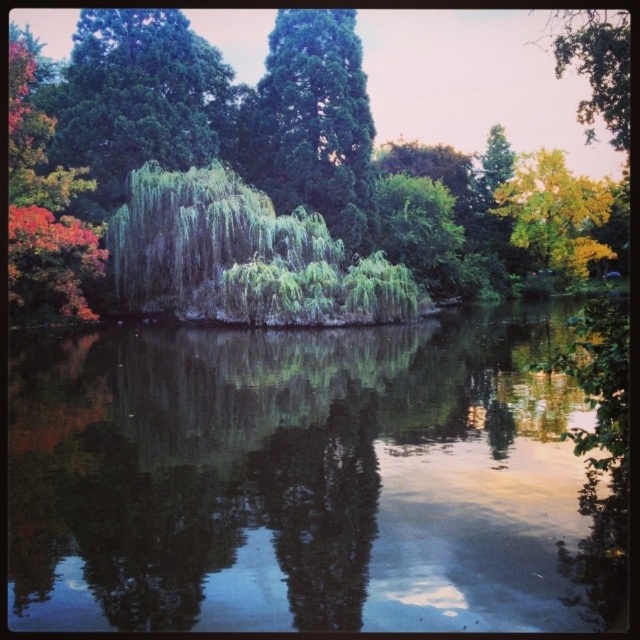
Is point (116, 20) positioned after point (570, 186)?

No, it is in front of (570, 186).

Which of these two, green leafy tree at upper left or yellow-green leafy willow at upper right, stands shorter?

green leafy tree at upper left is shorter.

Where is `green leafy tree at upper left`? This screenshot has width=640, height=640. green leafy tree at upper left is located at coordinates (138, 99).

Can you confirm if green leafy tree at center is smaller than green leafy willow at center?

Incorrect, green leafy tree at center is not smaller in size than green leafy willow at center.

Between green leafy tree at center and green leafy willow at center, which one is positioned lower?

green leafy willow at center is below.

Describe the element at coordinates (422, 88) in the screenshot. I see `green leafy tree at center` at that location.

The width and height of the screenshot is (640, 640). I want to click on green leafy tree at center, so click(422, 88).

Who is more distant from viewer, (17, 580) or (451, 68)?

The point (451, 68) is more distant.

Which is in front, point (509, 456) or point (26, 17)?

Point (509, 456)

Does point (532, 387) come in front of point (536, 52)?

That is True.

Where is `green reflective water at center`? green reflective water at center is located at coordinates (296, 477).